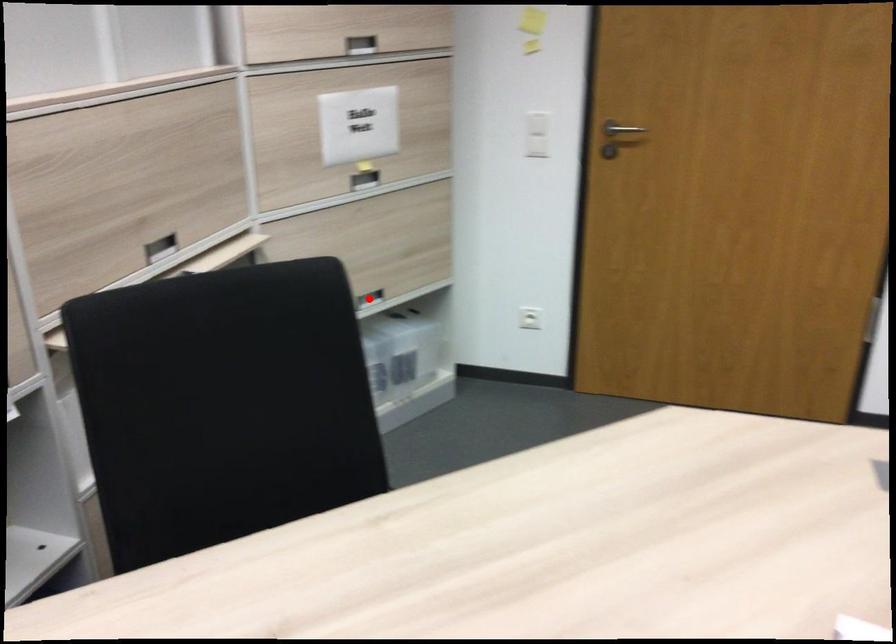
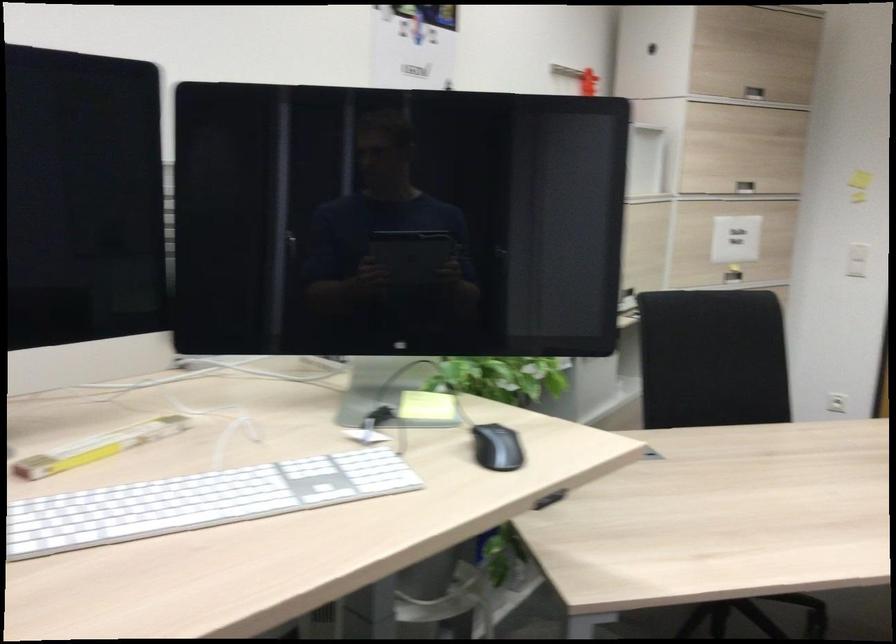
Question: I am providing you with two images of the same scene from different viewpoints. A red point is marked on the first image. Can you still see the location of the red point in image 2?

Choices:
 (A) Yes
 (B) No

Answer: (B)